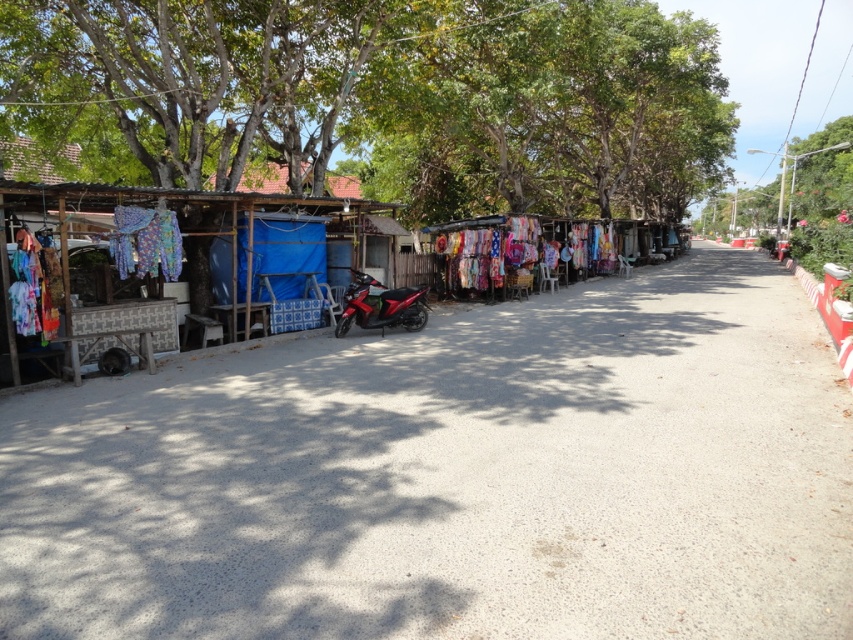
Question: Where is printed fabric at left located in relation to glossy red motorcycle at center in the image?

Choices:
 (A) above
 (B) below

Answer: (B)

Question: Is colorful fabric at center above green leafy tree at upper right?

Choices:
 (A) no
 (B) yes

Answer: (A)

Question: Which object is farther from the camera taking this photo?

Choices:
 (A) printed fabric at left
 (B) green leafy tree at upper center

Answer: (B)

Question: Which object appears farthest from the camera in this image?

Choices:
 (A) colorful fabric at center
 (B) glossy red motorcycle at center
 (C) printed fabric at left
 (D) green leafy tree at upper center

Answer: (A)

Question: Which point is farther to the camera?

Choices:
 (A) (607, 241)
 (B) (21, 262)

Answer: (A)

Question: Is green leafy tree at upper center positioned before glossy red motorcycle at center?

Choices:
 (A) yes
 (B) no

Answer: (B)